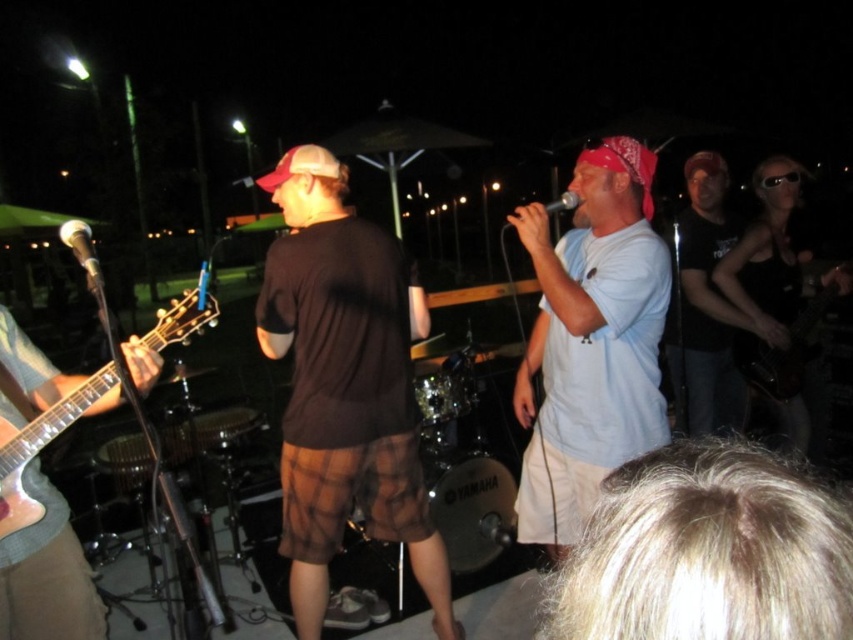
Is point (526, 358) in front of point (82, 253)?

No.

Which is in front, point (647, 394) or point (74, 221)?

Positioned in front is point (74, 221).

What are the coordinates of `light blue t-shirt at center` in the screenshot? It's located at (590, 340).

Is light blue t-shirt at center further to camera compared to metallic silver guitar at left?

Yes, light blue t-shirt at center is behind metallic silver guitar at left.

Describe the element at coordinates (590, 340) in the screenshot. This screenshot has width=853, height=640. I see `light blue t-shirt at center` at that location.

Locate an element on the screen. light blue t-shirt at center is located at coordinates (590, 340).

Between brown plaid shorts at center and light blue t-shirt at center, which one appears on the left side from the viewer's perspective?

Positioned to the left is brown plaid shorts at center.

Locate an element on the screen. brown plaid shorts at center is located at coordinates (344, 385).